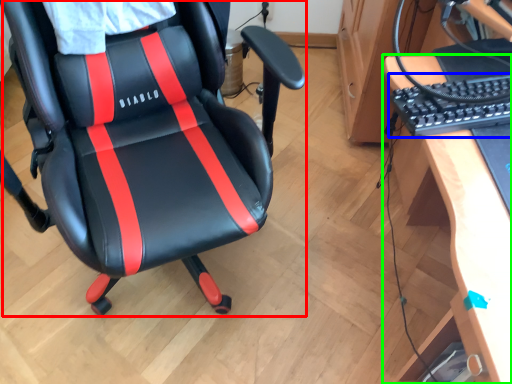
Question: Based on their relative distances, which object is nearer to chair (highlighted by a red box)? Choose from computer keyboard (highlighted by a blue box) and desk (highlighted by a green box).

Choices:
 (A) computer keyboard
 (B) desk

Answer: (A)